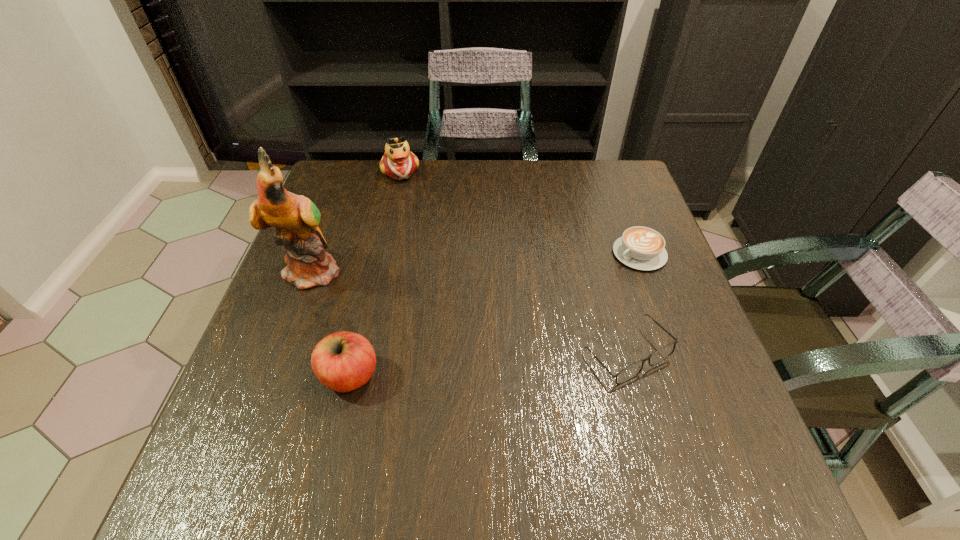
This screenshot has width=960, height=540. I want to click on vacant area at the far right corner of the desktop, so click(609, 195).

Locate an element on the screen. The image size is (960, 540). empty space that is in between the spectacles and the cappuccino is located at coordinates (633, 304).

Locate an element on the screen. The height and width of the screenshot is (540, 960). blank region between the third shortest object and the spectacles is located at coordinates (489, 365).

Locate an element on the screen. This screenshot has height=540, width=960. unoccupied position between the spectacles and the cappuccino is located at coordinates (633, 304).

Find the location of a particular element. This screenshot has width=960, height=540. free area in between the cappuccino and the parrot is located at coordinates (476, 261).

The width and height of the screenshot is (960, 540). I want to click on blank region between the cappuccino and the parrot, so click(x=476, y=261).

Locate an element on the screen. Image resolution: width=960 pixels, height=540 pixels. empty location between the spectacles and the third shortest object is located at coordinates (489, 365).

The image size is (960, 540). Identify the location of vacant space that's between the duck and the apple. [375, 274].

Identify the location of vacant space in between the spectacles and the farthest object. (514, 262).

Image resolution: width=960 pixels, height=540 pixels. I want to click on free space between the duck and the tallest object, so click(x=357, y=220).